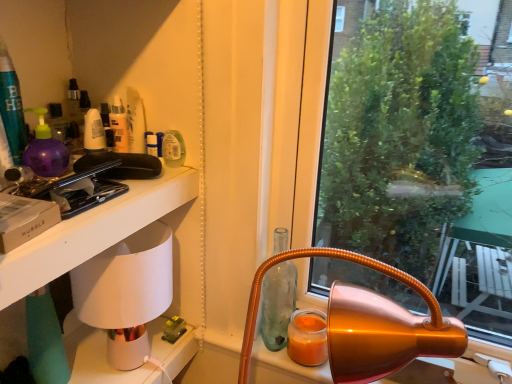
This screenshot has width=512, height=384. What do you see at coordinates (92, 232) in the screenshot?
I see `white matte table at left` at bounding box center [92, 232].

At what (x,y) coordinates should I click in order to perform the action: click on white matte table at left. Please return your answer as a coordinate pair (x, y). Looking at the image, I should click on (92, 232).

This screenshot has width=512, height=384. I want to click on white ceramic lamp at left, so click(126, 292).

The image size is (512, 384). Find the location of `transparent glass bottle at center`. transparent glass bottle at center is located at coordinates (278, 304).

Between orange matte candle at lower right and transparent glass bottle at center, which one has larger width?

With larger width is orange matte candle at lower right.

Measure the distance between orange matte candle at lower right and transparent glass bottle at center.

orange matte candle at lower right and transparent glass bottle at center are 2.79 inches apart.

Does point (298, 360) appear closer or farther from the camera than point (263, 320)?

Clearly, point (298, 360) is closer to the camera than point (263, 320).

Considering their positions, is orange matte candle at lower right located in front of or behind transparent glass bottle at center?

In the image, orange matte candle at lower right appears behind transparent glass bottle at center.

Is orange matte candle at lower right surrounded by white matte table at left?

No.

From a real-world perspective, is white matte table at left on orange matte candle at lower right?

Correct, in the physical world, white matte table at left is higher than orange matte candle at lower right.

Considering their positions, is white matte table at left located in front of or behind orange matte candle at lower right?

white matte table at left is in front of orange matte candle at lower right.

Is orange matte candle at lower right spatially inside white matte table at left, or outside of it?

orange matte candle at lower right is spatially situated outside white matte table at left.

From a real-world perspective, is orange matte candle at lower right located beneath white matte table at left?

Yes, from a real-world perspective, orange matte candle at lower right is under white matte table at left.

Is white matte table at left at the back of orange matte candle at lower right?

No, white matte table at left is not at the back of orange matte candle at lower right.

Looking at this image, can you confirm if orange matte candle at lower right is taller than white matte table at left?

No.

This screenshot has height=384, width=512. Identify the location of bottle below the white matte table at left (from a real-world perspective). (278, 304).

Looking at this image, from the image's perspective, is white matte table at left under transparent glass bottle at center?

No.

Are white matte table at left and transparent glass bottle at center far apart?

That's not correct — white matte table at left is a little close to transparent glass bottle at center.

Locate an element on the screen. This screenshot has height=384, width=512. oil lamp on the right of white matte table at left is located at coordinates (126, 292).

Is white ceramic lamp at left positioned far away from white matte table at left?

white ceramic lamp at left is near white matte table at left, not far away.

From a real-world perspective, which object rests below the other?

white ceramic lamp at left.

Considering the sizes of objects transparent glass bottle at center and white matte table at left in the image provided, who is wider, transparent glass bottle at center or white matte table at left?

white matte table at left.

Between transparent glass bottle at center and white matte table at left, which one appears on the right side from the viewer's perspective?

Positioned to the right is transparent glass bottle at center.

Who is smaller, transparent glass bottle at center or white matte table at left?

transparent glass bottle at center is smaller.

Is there a large distance between transparent glass bottle at center and white matte table at left?

No, there isn't a large distance between transparent glass bottle at center and white matte table at left.

Considering their positions, is white ceramic lamp at left located in front of or behind orange matte candle at lower right?

Clearly, white ceramic lamp at left is in front of orange matte candle at lower right.

Consider the image. Which point is more forward, (129, 359) or (313, 343)?

The point (313, 343) is more forward.

Do you think white ceramic lamp at left is within orange matte candle at lower right, or outside of it?

white ceramic lamp at left is not enclosed by orange matte candle at lower right.

How many degrees apart are the facing directions of white ceramic lamp at left and orange matte candle at lower right?

The facing directions of white ceramic lamp at left and orange matte candle at lower right are 87.3 degrees apart.

In the image, there is a transparent glass bottle at center. Identify the location of orange juice below it (from the image's perspective). Image resolution: width=512 pixels, height=384 pixels. (307, 338).

The width and height of the screenshot is (512, 384). What are the coordinates of `orange juice that is behind the white matte table at left` in the screenshot? It's located at (307, 338).

Based on their spatial positions, is white ceramic lamp at left or white matte table at left further from orange matte candle at lower right?

white matte table at left is further to orange matte candle at lower right.

In the scene shown: Which object lies nearer to the anchor point orange matte candle at lower right, transparent glass bottle at center or white matte table at left?

transparent glass bottle at center.

Which object lies further to the anchor point white matte table at left, white ceramic lamp at left or transparent glass bottle at center?

transparent glass bottle at center is positioned further to the anchor white matte table at left.

In the scene shown: Looking at the image, which one is located further to white matte table at left, transparent glass bottle at center or white ceramic lamp at left?

transparent glass bottle at center lies further to white matte table at left than the other object.

From the image, which object appears to be farther from white ceramic lamp at left, transparent glass bottle at center or orange matte candle at lower right?

Among the two, orange matte candle at lower right is located further to white ceramic lamp at left.

When comparing their distances from orange matte candle at lower right, does white matte table at left or transparent glass bottle at center seem closer?

transparent glass bottle at center lies closer to orange matte candle at lower right than the other object.

From the image, which object appears to be farther from white matte table at left, white ceramic lamp at left or orange matte candle at lower right?

orange matte candle at lower right lies further to white matte table at left than the other object.

Considering their positions, is white ceramic lamp at left positioned further to transparent glass bottle at center than orange matte candle at lower right?

The object further to transparent glass bottle at center is white ceramic lamp at left.

Image resolution: width=512 pixels, height=384 pixels. What are the coordinates of `oil lamp between white matte table at left and orange matte candle at lower right from left to right` in the screenshot? It's located at (126, 292).

Identify the location of bottle between white ceramic lamp at left and orange matte candle at lower right from left to right. This screenshot has width=512, height=384. (278, 304).

Where is `oil lamp located between white matte table at left and transparent glass bottle at center in the left-right direction`? Image resolution: width=512 pixels, height=384 pixels. oil lamp located between white matte table at left and transparent glass bottle at center in the left-right direction is located at coordinates (126, 292).

In order to click on bottle between white matte table at left and orange matte candle at lower right in the horizontal direction in this screenshot , I will do `click(278, 304)`.